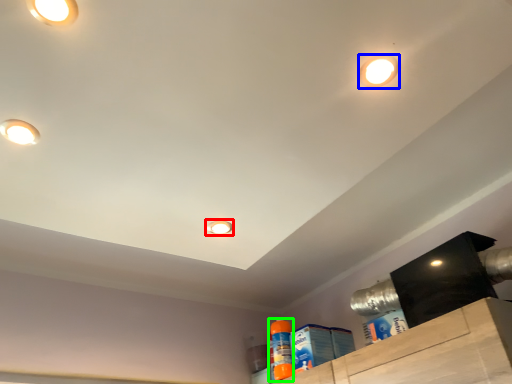
Question: Which object is the closest to the droplight (highlighted by a red box)? Choose among these: droplight (highlighted by a blue box) or cleaning product (highlighted by a green box).

Choices:
 (A) droplight
 (B) cleaning product

Answer: (A)